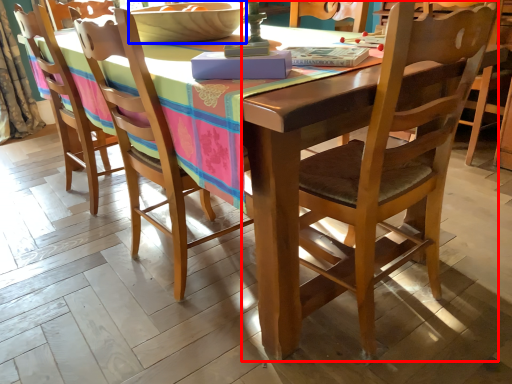
Question: Which point is further to the camera, chair (highlighted by a red box) or bowl (highlighted by a blue box)?

Choices:
 (A) chair
 (B) bowl

Answer: (B)